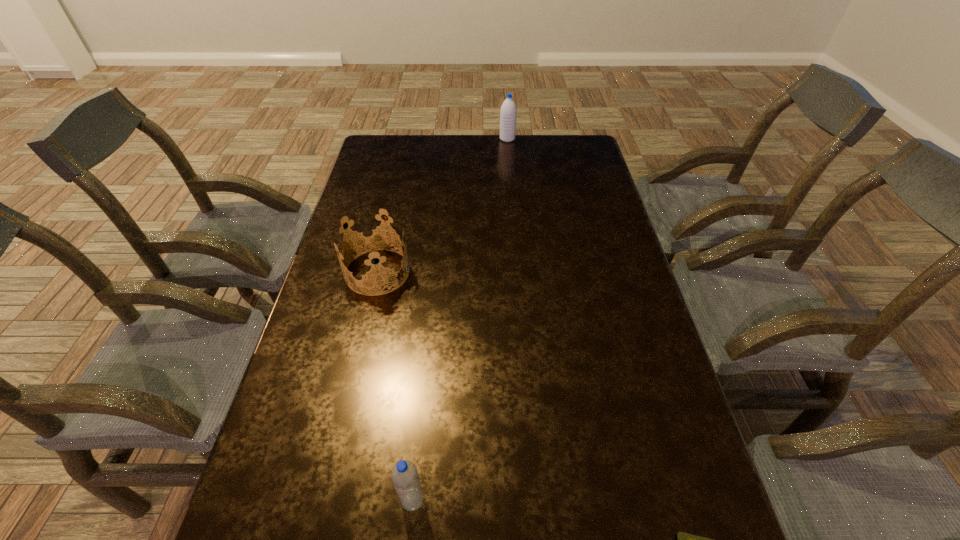
Image resolution: width=960 pixels, height=540 pixels. Find the location of `free spot between the nearer water bottle and the farther water bottle`. free spot between the nearer water bottle and the farther water bottle is located at coordinates (460, 320).

The width and height of the screenshot is (960, 540). What are the coordinates of `free space between the third nearest object and the right water bottle` in the screenshot? It's located at point(443,205).

Locate which object is the second closest to the shortest object. Please provide its 2D coordinates. Your answer should be formatted as a tuple, i.e. [(x, y)], where the tuple contains the x and y coordinates of a point satisfying the conditions above.

[(376, 273)]

I want to click on object that is the second closest to the third nearest object, so click(508, 114).

Where is `free location that satisfies the following two spatial constraints: 1. on the front side of the second object from left to right; 2. on the left side of the leftmost object`? This screenshot has height=540, width=960. free location that satisfies the following two spatial constraints: 1. on the front side of the second object from left to right; 2. on the left side of the leftmost object is located at coordinates (325, 500).

The width and height of the screenshot is (960, 540). What are the coordinates of `vacant space that satisfies the following two spatial constraints: 1. on the front side of the second farthest object; 2. on the right side of the second object from left to right` in the screenshot? It's located at (325, 500).

Identify the location of vacant space that satisfies the following two spatial constraints: 1. on the back side of the leftmost object; 2. on the right side of the right water bottle. (408, 139).